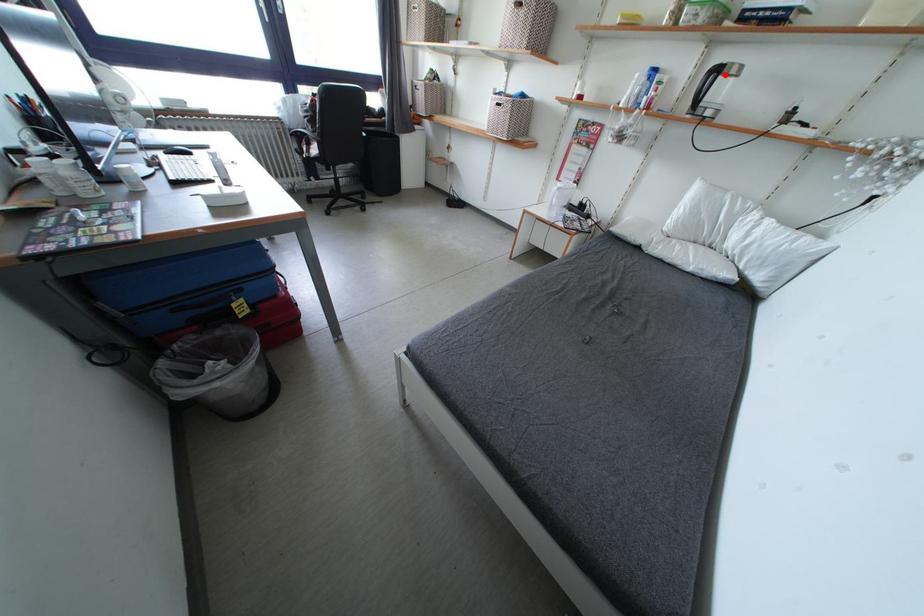
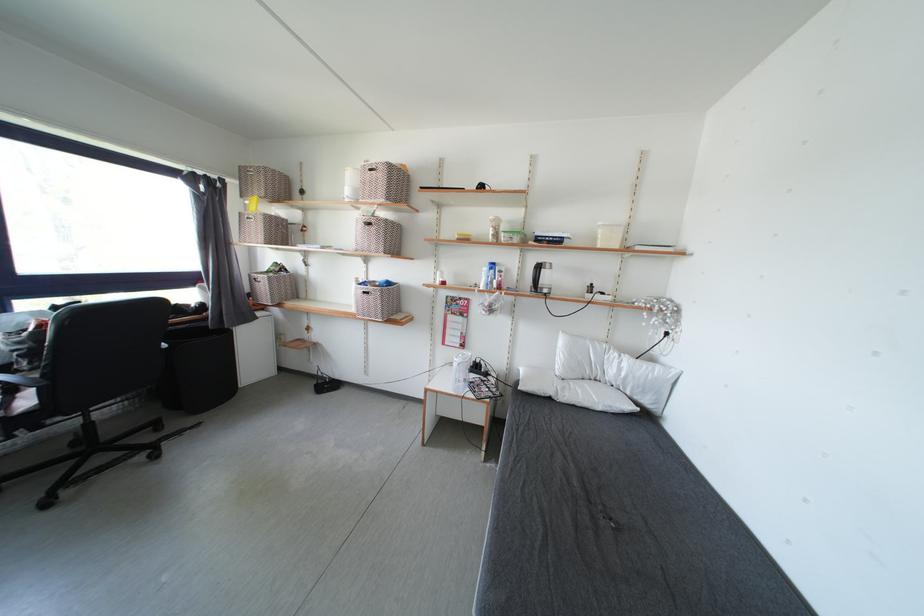
Question: I am providing you with two images of the same scene from different viewpoints. Image1 has a red point marked. In image2, the corresponding 3D location appears at what relative position? Reply with the corresponding letter.

Choices:
 (A) Closer
 (B) Farther

Answer: (A)